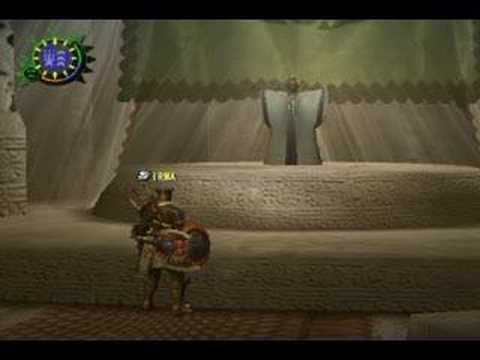
At what (x,y) coordinates should I click in order to perform the action: click on decorative pillar. Please return your answer as a coordinate pair (x, y). Looking at the image, I should click on (11, 159).